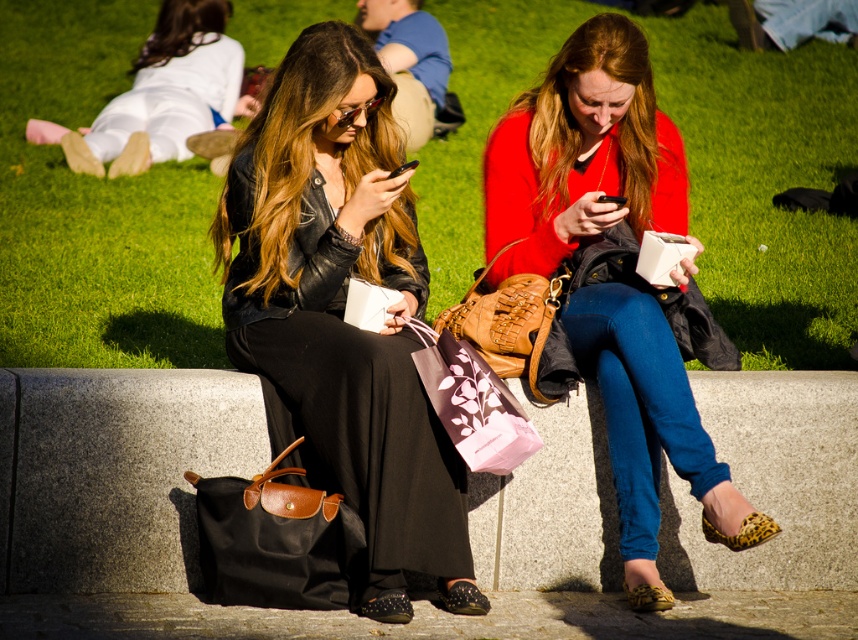
You are a delivery person who needs to place a small package between the matte black leather jacket at center and the black canvas bag at lower left. Can you fit the package there if it measures 15 inches in length?

The distance between the matte black leather jacket at center and the black canvas bag at lower left is 16.20 inches. Since the package is 15 inches long, it can fit in the space between them.

You are a photographer setting up a shot of the two women on the bench. You want to ensure the green grass at center and the matte red sweater at center are both visible in the frame. Which object should you focus on first to make sure both are in focus?

The green grass at center is located above the matte red sweater at center. To ensure both are in focus, you should focus on the matte red sweater at center first since it is closer to the camera, allowing the green grass at center to be captured within the depth of field.